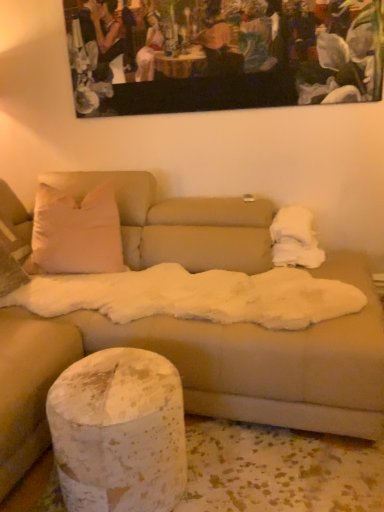
Question: Would you say white fluffy blanket at upper right is part of wooden painting at upper center's contents?

Choices:
 (A) no
 (B) yes

Answer: (A)

Question: From a real-world perspective, is wooden painting at upper center positioned under white fluffy blanket at upper right based on gravity?

Choices:
 (A) yes
 (B) no

Answer: (B)

Question: Can you confirm if wooden painting at upper center is wider than white fluffy blanket at upper right?

Choices:
 (A) no
 (B) yes

Answer: (A)

Question: Does wooden painting at upper center appear on the right side of white fluffy blanket at upper right?

Choices:
 (A) no
 (B) yes

Answer: (A)

Question: From the image's perspective, would you say wooden painting at upper center is positioned over white fluffy blanket at upper right?

Choices:
 (A) no
 (B) yes

Answer: (B)

Question: From a real-world perspective, is wooden painting at upper center above or below speckled white cylinder at lower left?

Choices:
 (A) below
 (B) above

Answer: (B)

Question: Considering the positions of point (352, 36) and point (142, 358), is point (352, 36) closer or farther from the camera than point (142, 358)?

Choices:
 (A) farther
 (B) closer

Answer: (A)

Question: Considering their positions, is wooden painting at upper center located in front of or behind speckled white cylinder at lower left?

Choices:
 (A) front
 (B) behind

Answer: (B)

Question: Looking at their shapes, would you say wooden painting at upper center is wider or thinner than speckled white cylinder at lower left?

Choices:
 (A) wide
 (B) thin

Answer: (B)

Question: Considering the positions of speckled white cylinder at lower left and wooden painting at upper center in the image, is speckled white cylinder at lower left wider or thinner than wooden painting at upper center?

Choices:
 (A) thin
 (B) wide

Answer: (B)

Question: Choose the correct answer: Is speckled white cylinder at lower left inside wooden painting at upper center or outside it?

Choices:
 (A) outside
 (B) inside

Answer: (A)

Question: Is point (162, 437) closer or farther from the camera than point (347, 58)?

Choices:
 (A) farther
 (B) closer

Answer: (B)

Question: In the image, is speckled white cylinder at lower left positioned in front of or behind wooden painting at upper center?

Choices:
 (A) behind
 (B) front

Answer: (B)

Question: From a real-world perspective, relative to white fluffy blanket at upper right, is wooden painting at upper center vertically above or below?

Choices:
 (A) above
 (B) below

Answer: (A)

Question: Do you think wooden painting at upper center is within white fluffy blanket at upper right, or outside of it?

Choices:
 (A) outside
 (B) inside

Answer: (A)